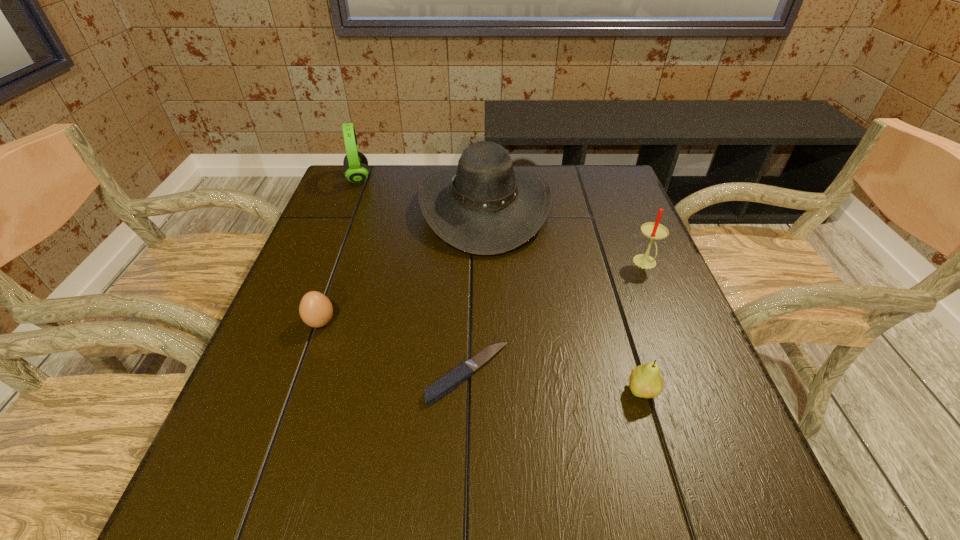
Image resolution: width=960 pixels, height=540 pixels. Identify the location of free point located on the front of the candle. (670, 323).

Where is `free spot located 0.300m on the back of the second object from right to left`? free spot located 0.300m on the back of the second object from right to left is located at coordinates (605, 271).

The image size is (960, 540). I want to click on free space located 0.230m on the front of the boiled egg, so click(x=279, y=442).

The image size is (960, 540). Find the location of `vacant area situated 0.290m on the right of the steak knife`. vacant area situated 0.290m on the right of the steak knife is located at coordinates (663, 374).

This screenshot has width=960, height=540. I want to click on headset that is at the far edge, so click(x=356, y=170).

Find the location of a particular element. The image size is (960, 540). cowboy hat located in the far edge section of the desktop is located at coordinates (485, 207).

Where is `headset situated at the left edge`? This screenshot has height=540, width=960. headset situated at the left edge is located at coordinates (356, 170).

The width and height of the screenshot is (960, 540). Identify the location of boiled egg that is at the left edge. (316, 310).

At what (x,y) coordinates should I click in order to perform the action: click on candle that is at the right edge. Please return your answer as a coordinate pair (x, y). The width and height of the screenshot is (960, 540). Looking at the image, I should click on point(652,230).

I want to click on pear located in the right edge section of the desktop, so click(645, 381).